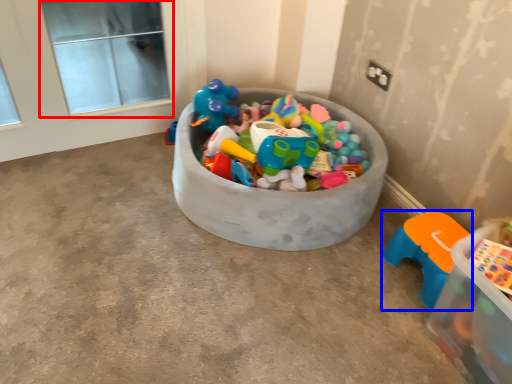
Question: Among these objects, which one is nearest to the camera, window screen (highlighted by a red box) or toy (highlighted by a blue box)?

Choices:
 (A) window screen
 (B) toy

Answer: (B)